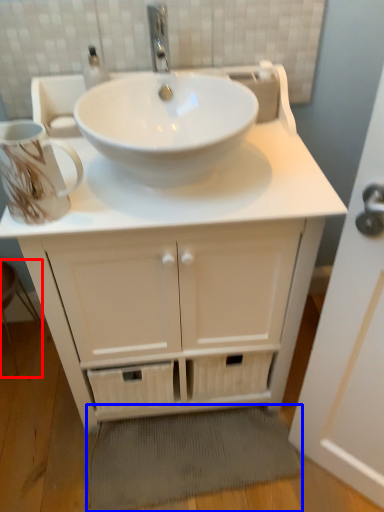
Question: Which point is closer to the camera, step stool (highlighted by a red box) or bath mat (highlighted by a blue box)?

Choices:
 (A) step stool
 (B) bath mat

Answer: (B)